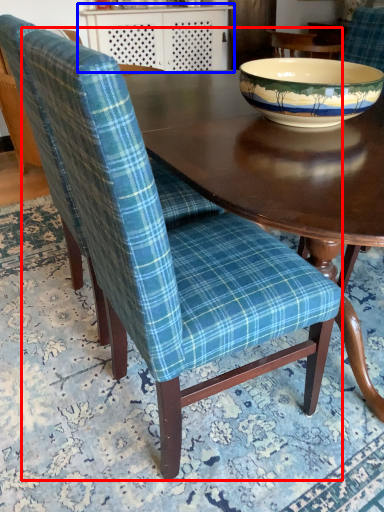
Question: Which of the following is the closest to the observer, chair (highlighted by a red box) or table (highlighted by a blue box)?

Choices:
 (A) chair
 (B) table

Answer: (A)